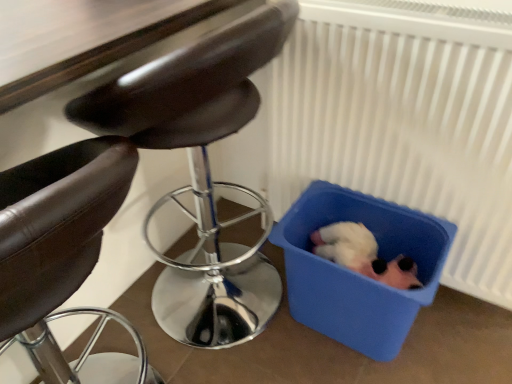
Question: Does white plastic radiator at lower right contain leather-like black chair at left, acting as the 1th chair starting from the left?

Choices:
 (A) yes
 (B) no

Answer: (B)

Question: From a real-world perspective, is white plastic radiator at lower right located higher than leather-like black chair at left, which is counted as the 2th chair, starting from the right?

Choices:
 (A) no
 (B) yes

Answer: (B)

Question: Can you confirm if white plastic radiator at lower right is smaller than leather-like black chair at left, which is counted as the 2th chair, starting from the right?

Choices:
 (A) yes
 (B) no

Answer: (A)

Question: Is white plastic radiator at lower right not near leather-like black chair at left, acting as the 1th chair starting from the left?

Choices:
 (A) no
 (B) yes

Answer: (A)

Question: From the image's perspective, is white plastic radiator at lower right beneath leather-like black chair at left, which is counted as the 2th chair, starting from the right?

Choices:
 (A) no
 (B) yes

Answer: (A)

Question: Does white plastic radiator at lower right appear on the right side of leather-like black chair at left, which is counted as the 2th chair, starting from the right?

Choices:
 (A) yes
 (B) no

Answer: (A)

Question: Is leather-like black chair at left, acting as the 1th chair starting from the left, positioned in front of white plastic radiator at lower right?

Choices:
 (A) yes
 (B) no

Answer: (A)

Question: Can you confirm if leather-like black chair at left, which is counted as the 2th chair, starting from the right, is smaller than white plastic radiator at lower right?

Choices:
 (A) yes
 (B) no

Answer: (B)

Question: Considering the relative sizes of leather-like black chair at left, which is counted as the 2th chair, starting from the right, and white plastic radiator at lower right in the image provided, is leather-like black chair at left, which is counted as the 2th chair, starting from the right, shorter than white plastic radiator at lower right?

Choices:
 (A) yes
 (B) no

Answer: (A)

Question: Is leather-like black chair at left, acting as the 1th chair starting from the left, not within white plastic radiator at lower right?

Choices:
 (A) no
 (B) yes

Answer: (B)

Question: From the image's perspective, does leather-like black chair at left, acting as the 1th chair starting from the left, appear lower than white plastic radiator at lower right?

Choices:
 (A) no
 (B) yes

Answer: (B)

Question: Does leather-like black chair at left, acting as the 1th chair starting from the left, have a lesser width compared to white plastic radiator at lower right?

Choices:
 (A) no
 (B) yes

Answer: (A)

Question: Can we say white plastic radiator at lower right lies outside blue plastic bin at lower right?

Choices:
 (A) no
 (B) yes

Answer: (B)